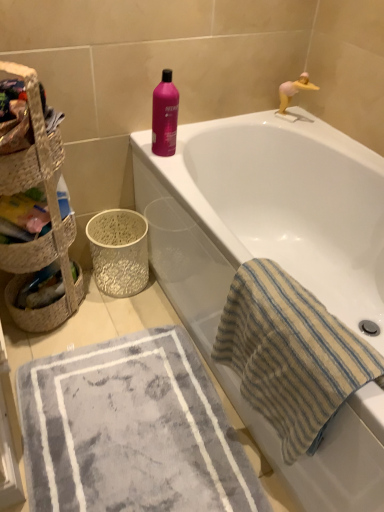
Image resolution: width=384 pixels, height=512 pixels. I want to click on vacant area that lies in front of pink glossy bottle at upper center, so (x=173, y=168).